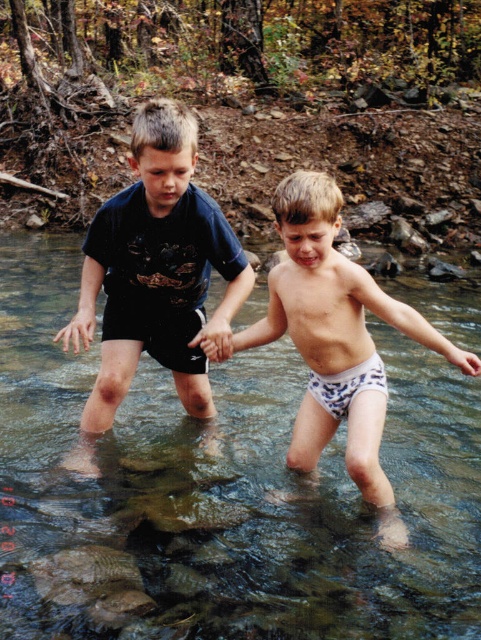
Does clear water stream at center appear under white printed shorts at center?

Yes, clear water stream at center is below white printed shorts at center.

Does clear water stream at center come behind white printed shorts at center?

Yes, it is.

You are a GUI agent. You are given a task and a screenshot of the screen. Output one action in this format:
    pyautogui.click(x=<x>, y=<y>)
    Task: Click on the clear water stream at center
    This screenshot has width=481, height=640.
    Given the screenshot: What is the action you would take?
    pyautogui.click(x=220, y=492)

Where is `clear water stream at center`? clear water stream at center is located at coordinates (220, 492).

Between clear water stream at center and dark blue cotton shorts at center, which one is positioned higher?

dark blue cotton shorts at center is above.

Find the location of a particular element. The width and height of the screenshot is (481, 640). clear water stream at center is located at coordinates (220, 492).

Does point (41, 388) come in front of point (126, 196)?

That is False.

In order to click on clear water stream at center in this screenshot , I will do `click(220, 492)`.

Does dark blue cotton shorts at center appear over white printed shorts at center?

Yes, dark blue cotton shorts at center is above white printed shorts at center.

The height and width of the screenshot is (640, 481). I want to click on dark blue cotton shorts at center, so click(x=155, y=273).